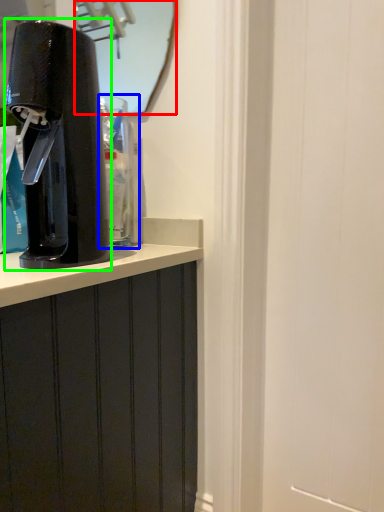
Question: Which object is positioned closest to mirror (highlighted by a red box)? Select from water cooler (highlighted by a blue box) and home appliance (highlighted by a green box).

Choices:
 (A) water cooler
 (B) home appliance

Answer: (A)